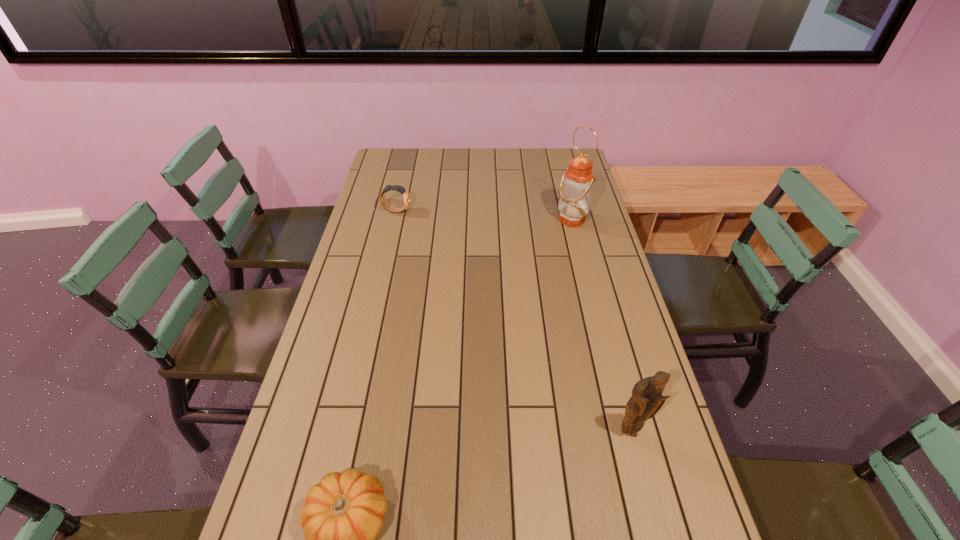
This screenshot has height=540, width=960. I want to click on free space that satisfies the following two spatial constraints: 1. on the face of the watch; 2. on the left side of the oil lamp, so click(395, 220).

This screenshot has width=960, height=540. I want to click on vacant space that satisfies the following two spatial constraints: 1. on the face of the tallest object; 2. on the right side of the watch, so click(395, 220).